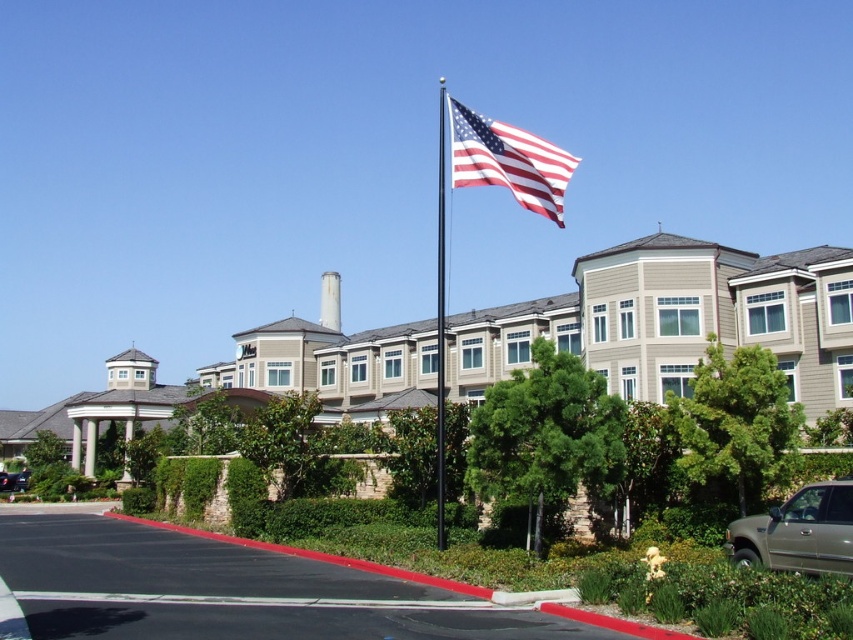
Question: Which of the following is the closest to the observer?

Choices:
 (A) (444, 90)
 (B) (833, 520)

Answer: (B)

Question: From the image, what is the correct spatial relationship of gold metallic truck at lower right in relation to shiny black sedan at lower left?

Choices:
 (A) above
 (B) below

Answer: (A)

Question: Is american flag at upper center to the right of shiny black sedan at lower left from the viewer's perspective?

Choices:
 (A) no
 (B) yes

Answer: (B)

Question: Which is nearer to the shiny black sedan at lower left?

Choices:
 (A) black metallic flag pole at center
 (B) gold metallic truck at lower right
 (C) american flag at upper center

Answer: (C)

Question: Which object is closer to the camera taking this photo?

Choices:
 (A) american flag at upper center
 (B) gold metallic truck at lower right
 (C) shiny black sedan at lower left

Answer: (B)

Question: Does black metallic flag pole at center come in front of shiny black sedan at lower left?

Choices:
 (A) yes
 (B) no

Answer: (A)